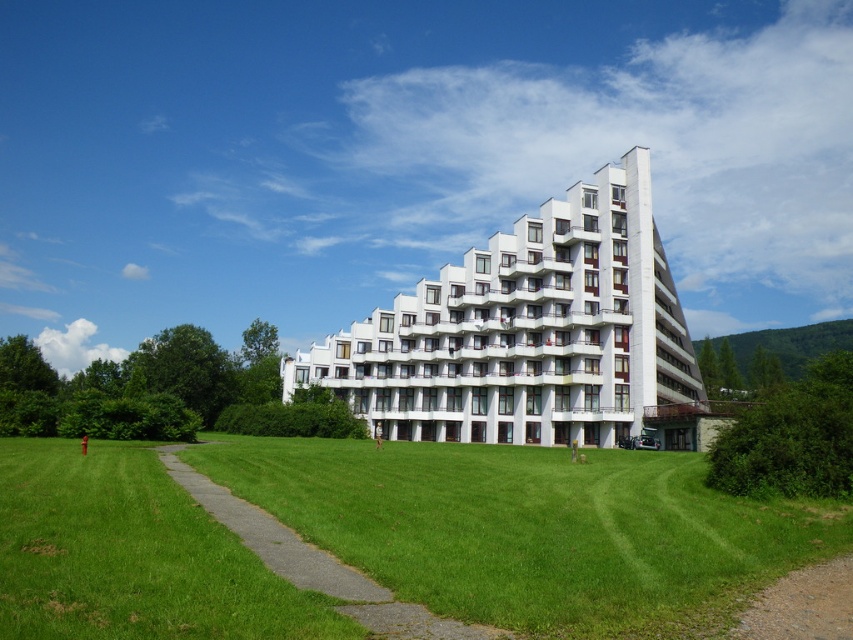
You are standing at the entrance of the building and want to take a photo of the point at coordinates [397,410]. If your camera has a maximum focus range of 130 meters, will you be able to focus on that point?

The distance of point [397,410] from the camera is 134.65 meters, which exceeds the camera maximum focus range of 130 meters. Therefore, you won not be able to focus on that point.

You are a landscape architect planning to install a new tree that grows up to 10 meters tall. Considering the white smooth building at center and the green grass at center, which object will the tree eventually surpass in height?

The tree will surpass the green grass at center in height because the white smooth building at center is already taller than the green grass at center, and the tree will grow up to 10 meters, which may still be shorter than the building depending on its actual height. However, the grass is much shorter, so the tree will definitely surpass it.

You are planning to take a photo of the white smooth building at center and the green grass at center. Which object should you focus on first if you want to capture both in a single frame without moving the camera?

You should focus on the white smooth building at center first because it is larger than the green grass at center, ensuring it occupies the main subject position while the green grass at center can be included in the background or foreground depending on the composition.